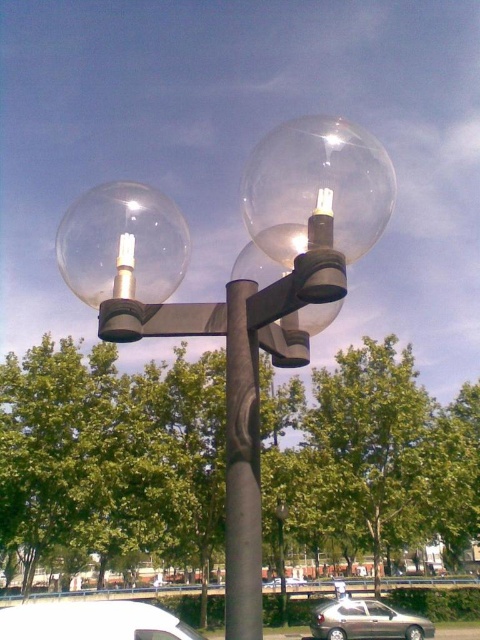
You are a city planner assessing the street lighting. You need to determine if the clear glass street light at center can accommodate a larger decorative element than the transparent glass globe at left. Based on their sizes, which one can hold a bigger accessory?

The clear glass street light at center has a larger size compared to the transparent glass globe at left, so it can accommodate a larger decorative element.